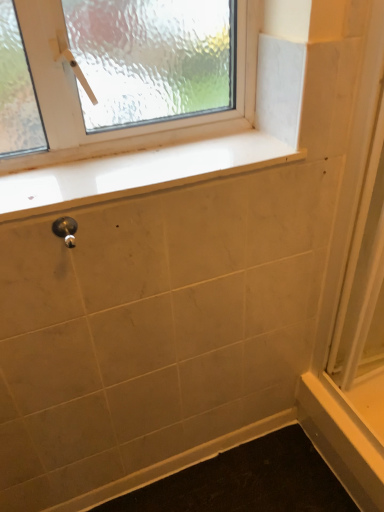
Question: Can you confirm if white glossy screen door at right is shorter than white glossy window sill at upper center?

Choices:
 (A) no
 (B) yes

Answer: (A)

Question: Considering the relative sizes of white glossy screen door at right and white glossy window sill at upper center in the image provided, is white glossy screen door at right wider than white glossy window sill at upper center?

Choices:
 (A) no
 (B) yes

Answer: (A)

Question: Is the depth of white glossy screen door at right greater than that of white glossy window sill at upper center?

Choices:
 (A) yes
 (B) no

Answer: (B)

Question: Would you consider white glossy screen door at right to be distant from white glossy window sill at upper center?

Choices:
 (A) yes
 (B) no

Answer: (B)

Question: Considering the relative sizes of white glossy screen door at right and white glossy window sill at upper center in the image provided, is white glossy screen door at right thinner than white glossy window sill at upper center?

Choices:
 (A) no
 (B) yes

Answer: (B)

Question: From a real-world perspective, is white glossy screen door at right located higher than white glossy window sill at upper center?

Choices:
 (A) no
 (B) yes

Answer: (A)

Question: From a real-world perspective, is white glossy screen door at right positioned under polished silver door handle at lower left based on gravity?

Choices:
 (A) no
 (B) yes

Answer: (B)

Question: Is polished silver door handle at lower left at the back of white glossy screen door at right?

Choices:
 (A) no
 (B) yes

Answer: (A)

Question: Considering the relative positions of white glossy screen door at right and polished silver door handle at lower left in the image provided, is white glossy screen door at right to the right of polished silver door handle at lower left from the viewer's perspective?

Choices:
 (A) no
 (B) yes

Answer: (B)

Question: Is polished silver door handle at lower left a part of white glossy screen door at right?

Choices:
 (A) yes
 (B) no

Answer: (B)

Question: Considering the relative sizes of white glossy screen door at right and polished silver door handle at lower left in the image provided, is white glossy screen door at right taller than polished silver door handle at lower left?

Choices:
 (A) yes
 (B) no

Answer: (A)

Question: Could you tell me if white glossy screen door at right is facing polished silver door handle at lower left?

Choices:
 (A) yes
 (B) no

Answer: (A)

Question: Would you say white glossy screen door at right is part of white glossy window sill at upper center's contents?

Choices:
 (A) no
 (B) yes

Answer: (A)